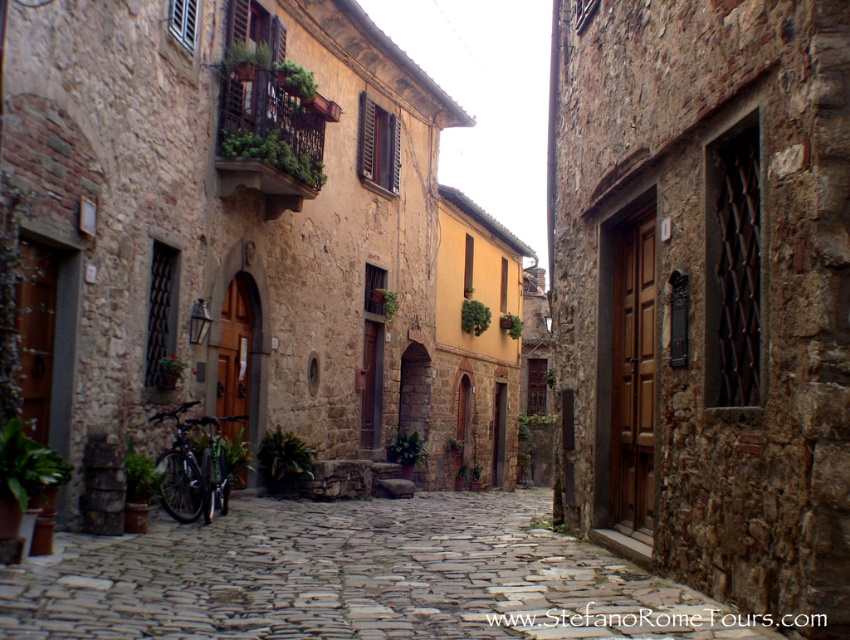
You are a delivery person trying to deliver a package to the brown wooden door at center. The package is too large to fit through the door. Can you move it along the stone cobblestone path at center to the back entrance instead?

The brown wooden door at center has a smaller size compared to stone cobblestone path at center, so the package may not fit through the door but could potentially be moved along the wider stone cobblestone path at center to the back entrance.

You are a delivery person with a cart that is 12 feet wide. You need to move your cart from the brown wooden door at center to the stone cobblestone path at center. Is there enough space for your cart to fit through the gap between them?

The distance between the brown wooden door at center and the stone cobblestone path at center is 12.01 feet, which is just slightly wider than the cart. Therefore, the cart can fit through the gap as the space is 0.01 feet wider than the cart.